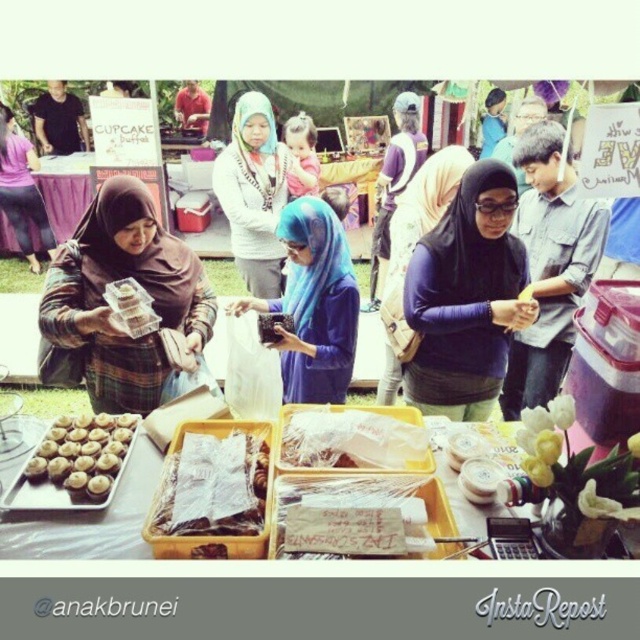
Is matte brown hijab at center positioned before yellow plastic tray at center?

That is False.

Is matte brown hijab at center bigger than yellow plastic tray at center?

Indeed, matte brown hijab at center has a larger size compared to yellow plastic tray at center.

Which is behind, point (128, 236) or point (138, 483)?

Positioned behind is point (128, 236).

This screenshot has height=640, width=640. Identify the location of matte brown hijab at center. (108, 305).

Is matte brown hijab at center positioned at the back of blue fabric headscarf at center?

No, matte brown hijab at center is closer to the viewer.

Is matte brown hijab at center taller than blue fabric headscarf at center?

Correct, matte brown hijab at center is much taller as blue fabric headscarf at center.

Is point (108, 381) closer to camera compared to point (292, 264)?

Yes, it is.

This screenshot has width=640, height=640. I want to click on matte brown hijab at center, so click(108, 305).

Based on the photo, can you confirm if matte white hijab at center is taller than matte brown cupcakes at lower left?

Yes, matte white hijab at center is taller than matte brown cupcakes at lower left.

Does matte white hijab at center have a lesser width compared to matte brown cupcakes at lower left?

No.

This screenshot has height=640, width=640. What do you see at coordinates (253, 193) in the screenshot? I see `matte white hijab at center` at bounding box center [253, 193].

Identify the location of matte white hijab at center. (253, 193).